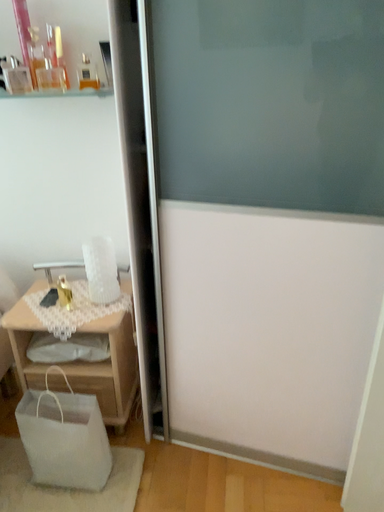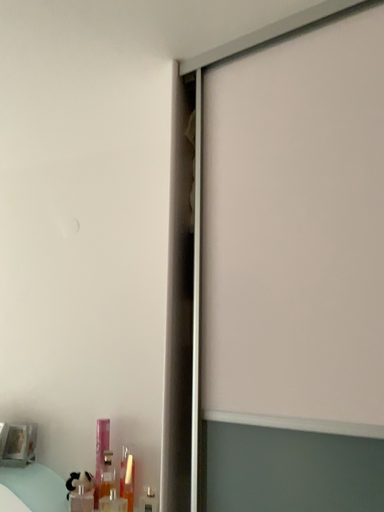
Question: How did the camera likely rotate when shooting the video?

Choices:
 (A) rotated downward
 (B) rotated upward

Answer: (B)